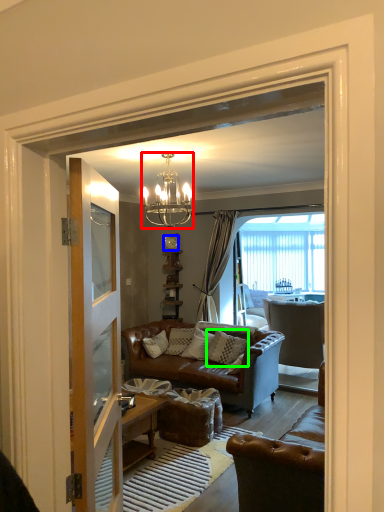
Question: Based on their relative distances, which object is nearer to lamp (highlighted by a red box)? Choose from clock (highlighted by a blue box) and pillow (highlighted by a green box).

Choices:
 (A) clock
 (B) pillow

Answer: (B)